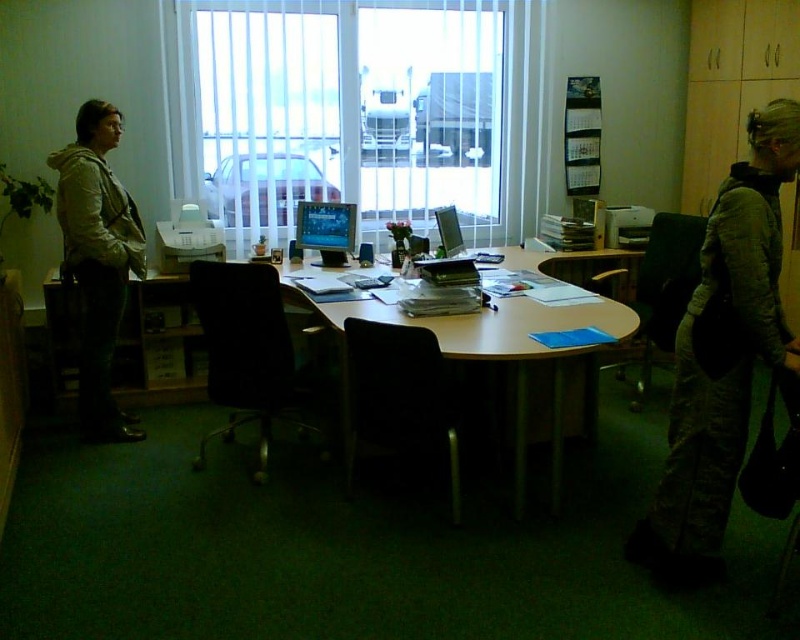
Question: Which of the following is the farthest from the observer?

Choices:
 (A) black leather swivel chair at center
 (B) green corduroy jacket at right

Answer: (A)

Question: Does white vertical blinds at center appear under light gray hoodie at left?

Choices:
 (A) no
 (B) yes

Answer: (A)

Question: Does light gray hoodie at left have a smaller size compared to shiny silver monitor at center?

Choices:
 (A) no
 (B) yes

Answer: (A)

Question: Does green corduroy jacket at right appear on the right side of light gray hoodie at left?

Choices:
 (A) yes
 (B) no

Answer: (A)

Question: Estimate the real-world distances between objects in this image. Which object is farther from the white vertical blinds at center?

Choices:
 (A) green corduroy jacket at right
 (B) black leather swivel chair at center
 (C) wooden table at center

Answer: (A)

Question: Which object appears closest to the camera in this image?

Choices:
 (A) black leather swivel chair at center
 (B) black fabric swivel chair at center

Answer: (A)